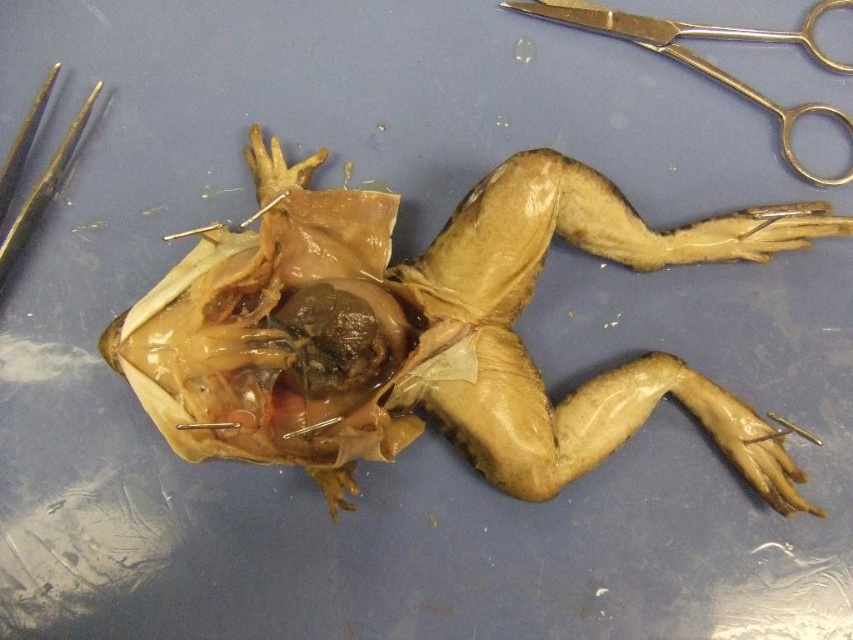
Which is behind, point (630, 19) or point (9, 264)?

Positioned behind is point (630, 19).

Is satin silver scissors at upper right thinner than gold metallic forceps at upper left?

In fact, satin silver scissors at upper right might be wider than gold metallic forceps at upper left.

What do you see at coordinates (704, 60) in the screenshot? This screenshot has height=640, width=853. I see `satin silver scissors at upper right` at bounding box center [704, 60].

This screenshot has width=853, height=640. What are the coordinates of `satin silver scissors at upper right` in the screenshot? It's located at (704, 60).

Does translucent flesh at center have a greater width compared to gold metallic forceps at upper left?

Yes, translucent flesh at center is wider than gold metallic forceps at upper left.

Is point (317, 468) positioned after point (68, 140)?

That is True.

Identify the location of translucent flesh at center. The height and width of the screenshot is (640, 853). coord(428,332).

Is translucent flesh at center positioned at the back of satin silver scissors at upper right?

No, it is not.

Is translucent flesh at center smaller than satin silver scissors at upper right?

No.

Image resolution: width=853 pixels, height=640 pixels. Describe the element at coordinates (428, 332) in the screenshot. I see `translucent flesh at center` at that location.

This screenshot has height=640, width=853. What are the coordinates of `translucent flesh at center` in the screenshot? It's located at (428, 332).